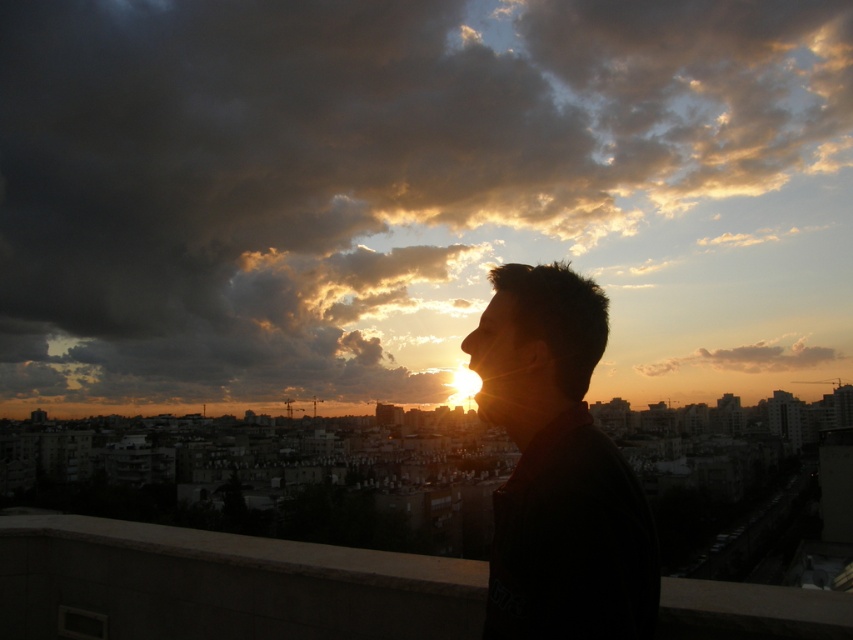
Question: Does dark gray cloud at upper center have a lesser width compared to silhouette hair at center?

Choices:
 (A) yes
 (B) no

Answer: (B)

Question: Is concrete ledge at center further to camera compared to silhouette hair at right?

Choices:
 (A) no
 (B) yes

Answer: (A)

Question: Based on their relative distances, which object is nearer to the silhouette hair at center?

Choices:
 (A) white fluffy cloud at upper center
 (B) silhouette hair at right
 (C) dark gray cloud at upper center

Answer: (B)

Question: Which object appears closest to the camera in this image?

Choices:
 (A) white fluffy cloud at upper center
 (B) silhouette hair at center
 (C) concrete ledge at center

Answer: (C)

Question: Which point is farther from the camera taking this photo?

Choices:
 (A) (45, 580)
 (B) (287, 305)
 (C) (480, 388)

Answer: (B)

Question: Where is silhouette hair at center located in relation to white fluffy cloud at upper center in the image?

Choices:
 (A) left
 (B) right

Answer: (A)